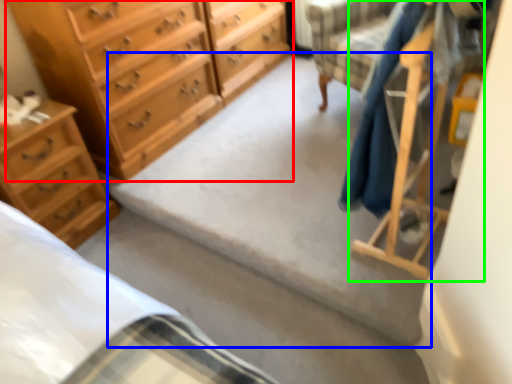
Question: Which object is positioned closest to chest of drawers (highlighted by a red box)? Select from concrete (highlighted by a blue box) and furniture (highlighted by a green box).

Choices:
 (A) concrete
 (B) furniture

Answer: (A)